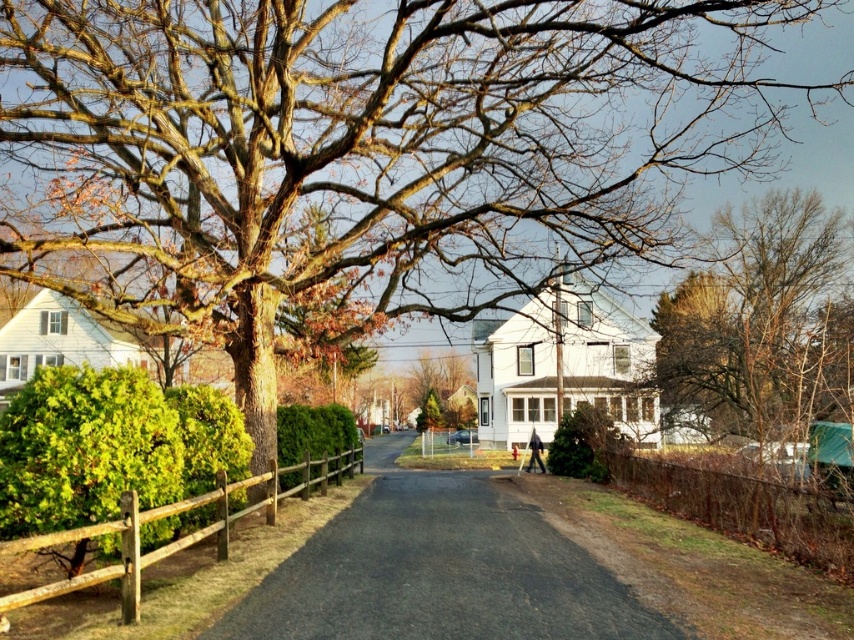
Question: Estimate the real-world distances between objects in this image. Which object is closer to the brown wooden fence at left?

Choices:
 (A) brown wooden fence at right
 (B) brown textured tree at upper right
 (C) asphalt at center
 (D) green textured hedge at center

Answer: (C)

Question: Which point is closer to the camera taking this photo?

Choices:
 (A) (325, 468)
 (B) (314, 424)

Answer: (A)

Question: Can you confirm if brown wooden fence at left is smaller than green matte hedge at center?

Choices:
 (A) no
 (B) yes

Answer: (A)

Question: Considering the relative positions of brown textured tree at upper right and green textured hedge at center in the image provided, where is brown textured tree at upper right located with respect to green textured hedge at center?

Choices:
 (A) below
 (B) above

Answer: (B)

Question: Which object appears closest to the camera in this image?

Choices:
 (A) asphalt at center
 (B) green matte hedge at center

Answer: (A)

Question: Considering the relative positions of brown textured tree at upper right and green textured hedge at center in the image provided, where is brown textured tree at upper right located with respect to green textured hedge at center?

Choices:
 (A) below
 (B) above

Answer: (B)